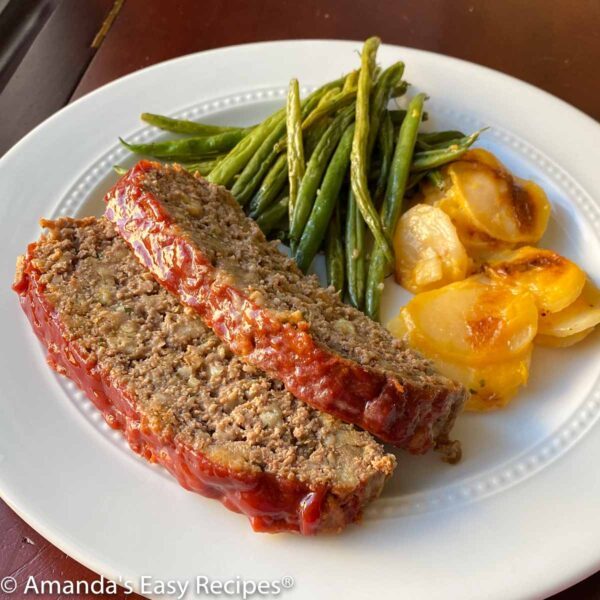
I want to click on white plate, so click(x=412, y=551).